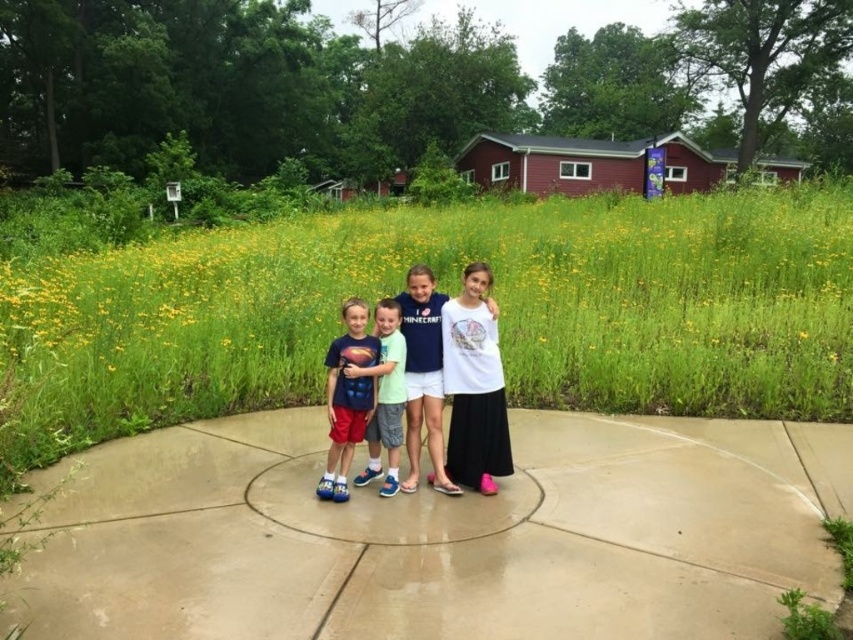
Can you confirm if white matte shirt at center is taller than light blue t-shirt at center?

Correct, white matte shirt at center is much taller as light blue t-shirt at center.

Which of these two, white matte shirt at center or light blue t-shirt at center, stands shorter?

light blue t-shirt at center

Identify the location of white matte shirt at center. Image resolution: width=853 pixels, height=640 pixels. (422, 376).

Is point (498, 420) positioned before point (343, 337)?

No, (498, 420) is further to viewer.

What do you see at coordinates (474, 385) in the screenshot? This screenshot has height=640, width=853. I see `white matte skirt at center` at bounding box center [474, 385].

At what (x,y) coordinates should I click in order to perform the action: click on white matte skirt at center. Please return your answer as a coordinate pair (x, y). The width and height of the screenshot is (853, 640). Looking at the image, I should click on (474, 385).

Between smooth concrete pavement at center and white matte skirt at center, which one has more height?

white matte skirt at center

Between smooth concrete pavement at center and white matte skirt at center, which one has less height?

smooth concrete pavement at center is shorter.

Between point (720, 436) and point (482, 348), which one is positioned in front?

Point (482, 348)

The width and height of the screenshot is (853, 640). What are the coordinates of `smooth concrete pavement at center` in the screenshot? It's located at (439, 536).